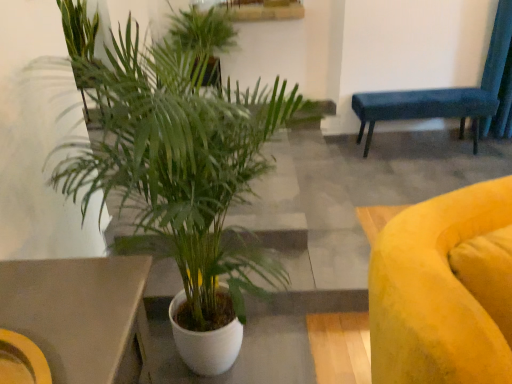
Question: From the image's perspective, is velvet blue bench at upper right above or below green leafy plant at upper center, which appears as the 1th houseplant when viewed from the back?

Choices:
 (A) above
 (B) below

Answer: (B)

Question: Is velvet blue bench at upper right wider or thinner than green leafy plant at upper center, the second houseplant positioned from the bottom?

Choices:
 (A) wide
 (B) thin

Answer: (B)

Question: Estimate the real-world distances between objects in this image. Which object is closer to the white ceramic plant at center, positioned as the first houseplant in bottom-to-top order?

Choices:
 (A) velvet blue bench at upper right
 (B) green leafy plant at upper center, which is the 1th houseplant from top to bottom

Answer: (B)

Question: Which object is the farthest from the white ceramic plant at center, the second houseplant from the back?

Choices:
 (A) velvet blue bench at upper right
 (B) green leafy plant at upper center, which appears as the 1th houseplant when viewed from the back

Answer: (A)